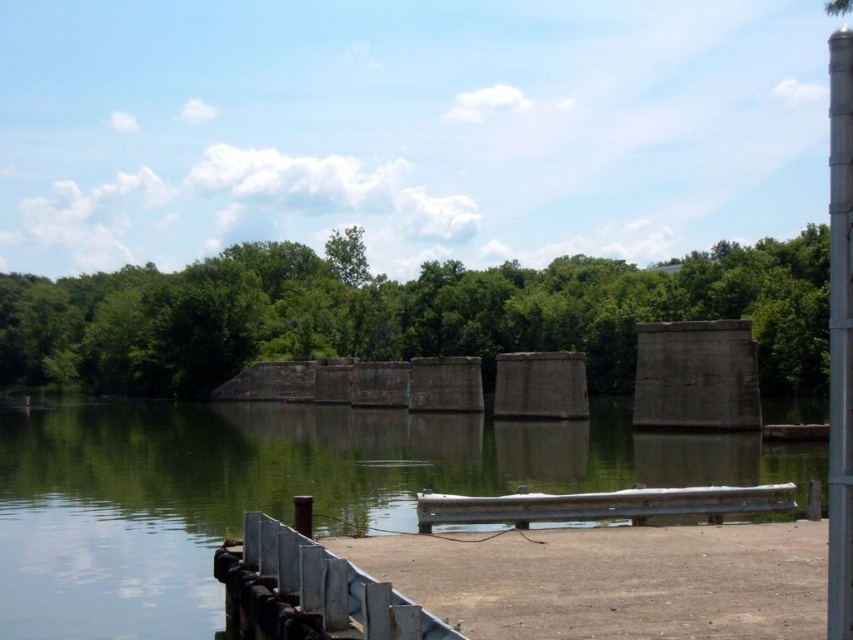
You are standing on the dock and want to reach the green concrete river at center. Based on the coordinates provided, in which direction should you walk from your current position on the dock?

The green concrete river at center is located at coordinates point (x=280, y=492). Since you are on the dock, you should walk towards the center of the image to reach it.

In the scene shown: You are standing on the dock and looking at the point marked by coordinates point (280, 492). What is the color of the object located at that point?

The point (280, 492) marks green concrete river at center, so the color is green.

You are standing on the dock and want to know the exact coordinates of the green concrete river at center. What are its coordinates?

The green concrete river at center is located at point (280, 492).